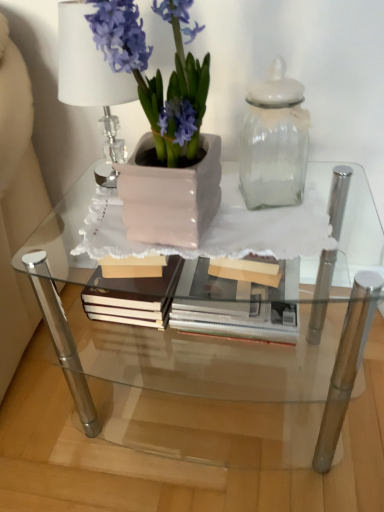
Question: Is matte pink pot at left shorter than clear glass table at center?

Choices:
 (A) no
 (B) yes

Answer: (B)

Question: Is matte pink pot at left touching clear glass table at center?

Choices:
 (A) yes
 (B) no

Answer: (B)

Question: From a real-world perspective, does matte pink pot at left stand above clear glass table at center?

Choices:
 (A) no
 (B) yes

Answer: (B)

Question: Does matte pink pot at left have a lesser width compared to clear glass table at center?

Choices:
 (A) no
 (B) yes

Answer: (B)

Question: Considering the relative sizes of matte pink pot at left and clear glass table at center in the image provided, is matte pink pot at left taller than clear glass table at center?

Choices:
 (A) no
 (B) yes

Answer: (A)

Question: Considering the positions of point pos(289,121) and point pos(84,81), is point pos(289,121) closer or farther from the camera than point pos(84,81)?

Choices:
 (A) farther
 (B) closer

Answer: (A)

Question: Considering the positions of transparent glass jar at upper right and clear crystal table lamp at upper left in the image, is transparent glass jar at upper right taller or shorter than clear crystal table lamp at upper left?

Choices:
 (A) tall
 (B) short

Answer: (B)

Question: Considering the positions of transparent glass jar at upper right and clear crystal table lamp at upper left in the image, is transparent glass jar at upper right bigger or smaller than clear crystal table lamp at upper left?

Choices:
 (A) big
 (B) small

Answer: (B)

Question: From a real-world perspective, is transparent glass jar at upper right above or below clear crystal table lamp at upper left?

Choices:
 (A) above
 (B) below

Answer: (B)

Question: Relative to transparent glass jar at upper right, is clear glass table at center in front or behind?

Choices:
 (A) behind
 (B) front

Answer: (B)

Question: From the image's perspective, is clear glass table at center above or below transparent glass jar at upper right?

Choices:
 (A) above
 (B) below

Answer: (B)

Question: From a real-world perspective, is clear glass table at center physically located above or below transparent glass jar at upper right?

Choices:
 (A) below
 (B) above

Answer: (A)

Question: In terms of size, does clear glass table at center appear bigger or smaller than transparent glass jar at upper right?

Choices:
 (A) big
 (B) small

Answer: (A)

Question: Is point (307, 448) closer or farther from the camera than point (86, 81)?

Choices:
 (A) farther
 (B) closer

Answer: (A)

Question: Would you say clear glass table at center is to the left or to the right of clear crystal table lamp at upper left in the picture?

Choices:
 (A) left
 (B) right

Answer: (B)